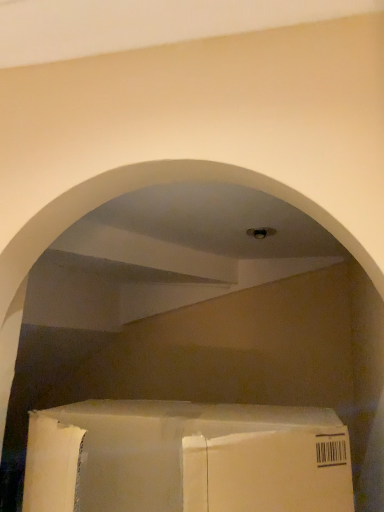
Find the location of a particular element. Image resolution: width=384 pixels, height=512 pixels. white cardboard box at center is located at coordinates (x=186, y=458).

What do you see at coordinates (186, 458) in the screenshot? The height and width of the screenshot is (512, 384). I see `white cardboard box at center` at bounding box center [186, 458].

I want to click on white cardboard box at center, so pos(186,458).